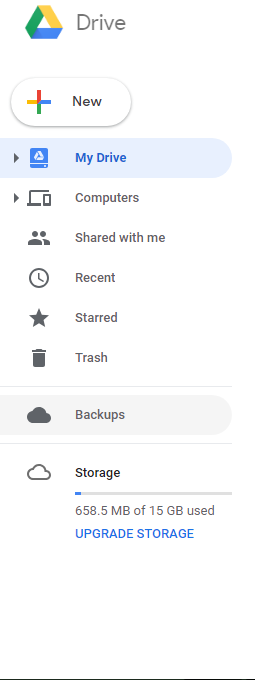
Find the location of a particular element. The width and height of the screenshot is (255, 680). computer tab is located at coordinates (156, 201).